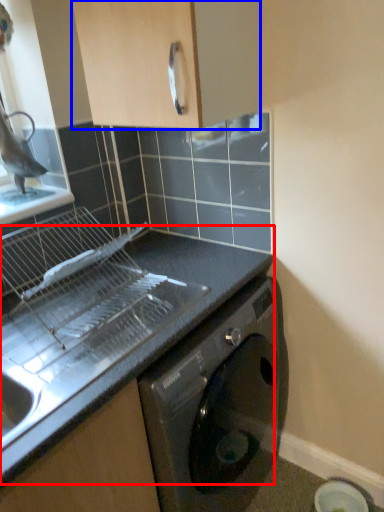
Question: Which object appears closest to the camera in this image, countertop (highlighted by a red box) or cabinetry (highlighted by a blue box)?

Choices:
 (A) countertop
 (B) cabinetry

Answer: (B)